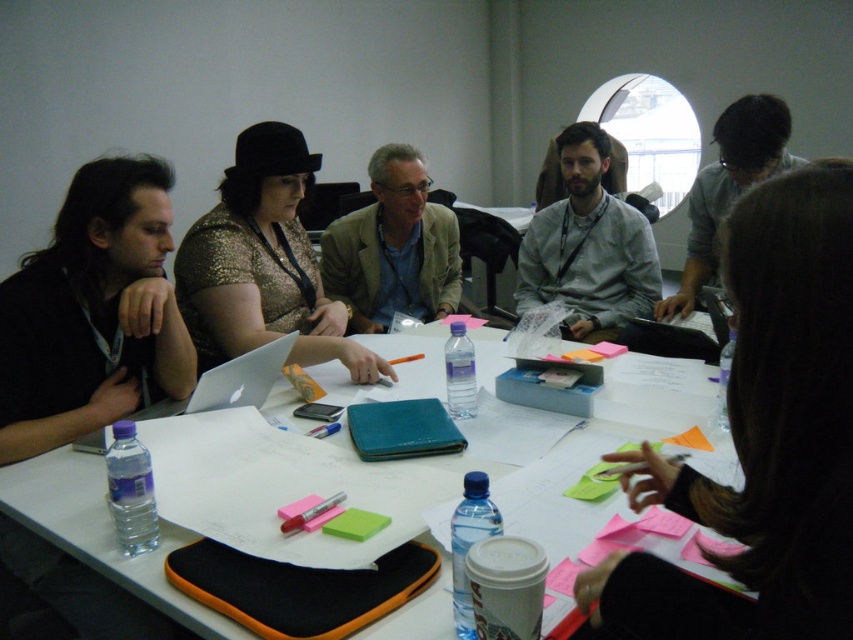
Which is in front, point (450, 616) or point (236, 401)?

Point (450, 616)

Is point (204, 636) more distant than point (194, 412)?

No, it is not.

At what (x,y) coordinates should I click in order to perform the action: click on white paper at center. Please return your answer as a coordinate pair (x, y). This screenshot has width=853, height=640. Looking at the image, I should click on (97, 532).

At what (x,y) coordinates should I click in order to perform the action: click on white paper at center. Please return your answer as a coordinate pair (x, y). Looking at the image, I should click on (97, 532).

Which of these two, black matte shirt at left or white paper at center, stands shorter?

white paper at center is shorter.

Is black matte shirt at left above white paper at center?

Yes, black matte shirt at left is above white paper at center.

Who is more distant from viewer, (74, 204) or (541, 513)?

The point (74, 204) is behind.

This screenshot has width=853, height=640. What are the coordinates of `black matte shirt at left` in the screenshot? It's located at (91, 312).

How much distance is there between dark brown hair at center and gray matte shirt at center?

5.95 feet

Between dark brown hair at center and gray matte shirt at center, which one has more height?

With more height is gray matte shirt at center.

Image resolution: width=853 pixels, height=640 pixels. I want to click on dark brown hair at center, so click(762, 440).